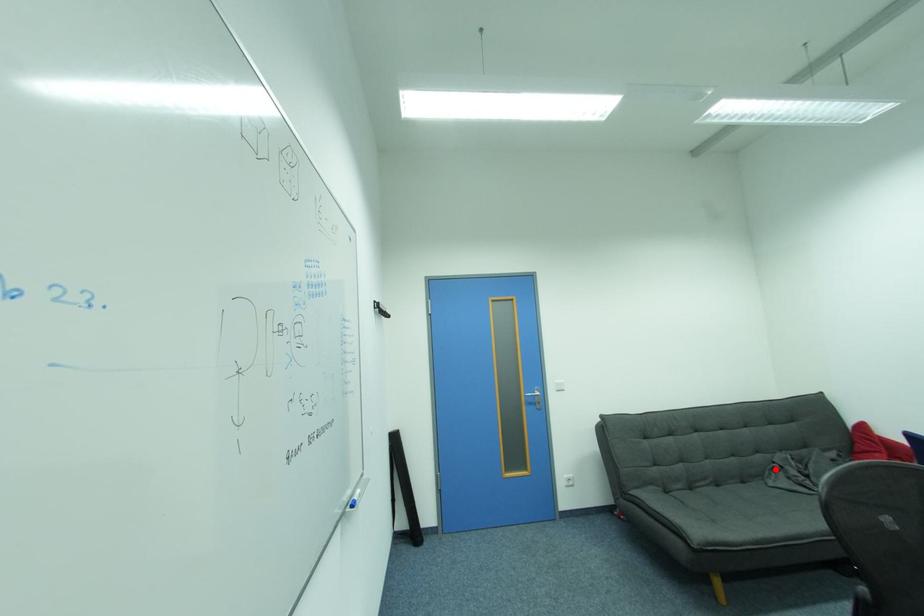
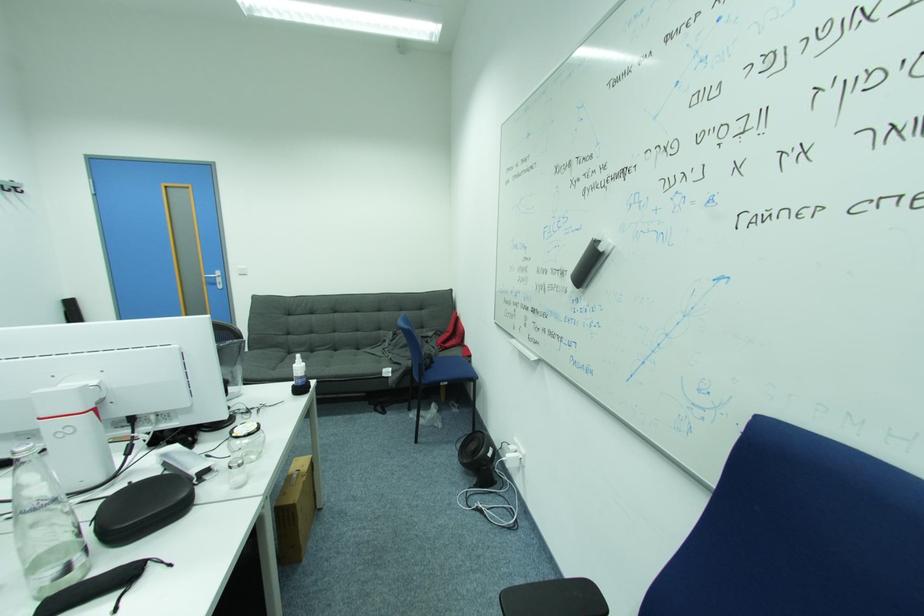
Where in the second image is the point corresponding to the highlighted location from the first image?

(388, 341)